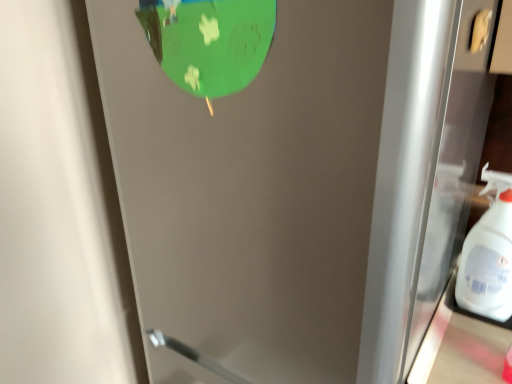
Question: From a real-world perspective, is white plastic spray bottle at right above or below satin silver refrigerator at center?

Choices:
 (A) above
 (B) below

Answer: (A)

Question: In the image, is white plastic spray bottle at right positioned in front of or behind satin silver refrigerator at center?

Choices:
 (A) behind
 (B) front

Answer: (A)

Question: From the image's perspective, relative to satin silver refrigerator at center, is white plastic spray bottle at right above or below?

Choices:
 (A) above
 (B) below

Answer: (A)

Question: From the image's perspective, is satin silver refrigerator at center positioned above or below white plastic spray bottle at right?

Choices:
 (A) below
 (B) above

Answer: (A)

Question: Considering their positions, is satin silver refrigerator at center located in front of or behind white plastic spray bottle at right?

Choices:
 (A) behind
 (B) front

Answer: (B)

Question: Considering the positions of point (414, 84) and point (506, 296), is point (414, 84) closer or farther from the camera than point (506, 296)?

Choices:
 (A) farther
 (B) closer

Answer: (B)

Question: Considering the positions of satin silver refrigerator at center and white plastic spray bottle at right in the image, is satin silver refrigerator at center bigger or smaller than white plastic spray bottle at right?

Choices:
 (A) big
 (B) small

Answer: (A)